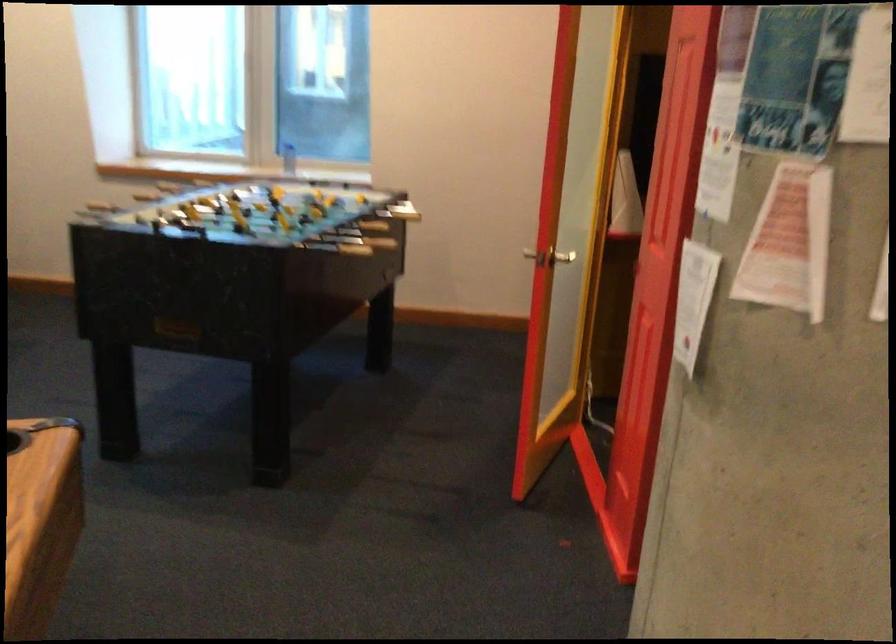
This screenshot has height=644, width=896. Identify the location of silver door handle. (562, 257).